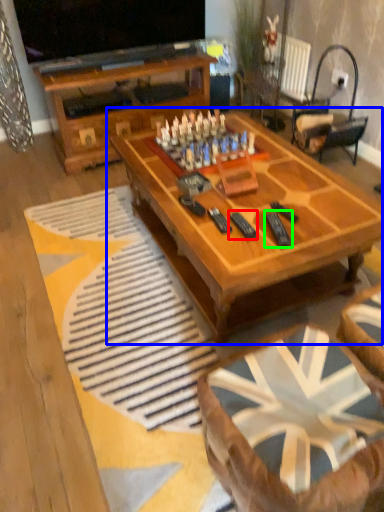
Question: Based on their relative distances, which object is farther from remote (highlighted by a red box)? Choose from coffee table (highlighted by a blue box) and remote (highlighted by a green box).

Choices:
 (A) coffee table
 (B) remote

Answer: (A)